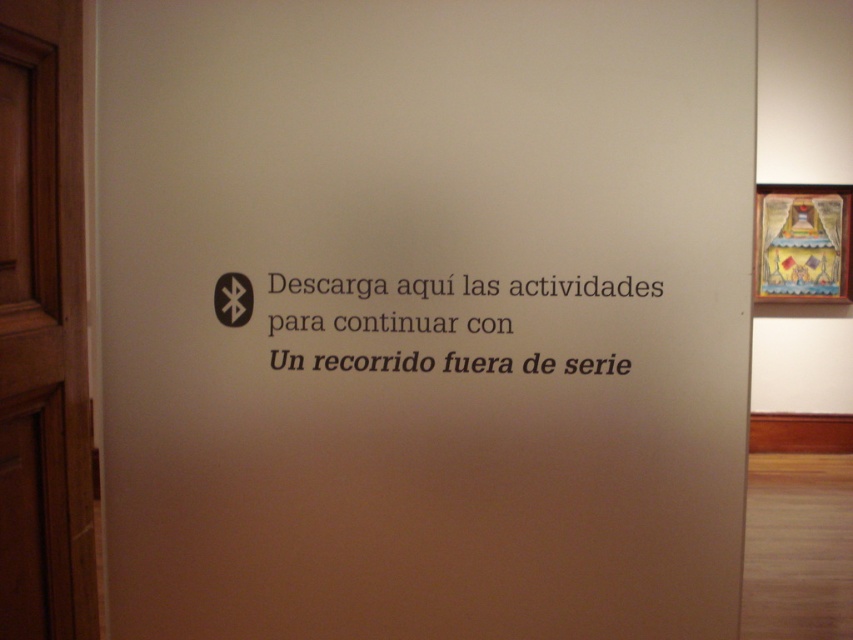
Is brown wooden door at left to the left of wooden painted artwork at upper right from the viewer's perspective?

Yes, brown wooden door at left is to the left of wooden painted artwork at upper right.

Is brown wooden door at left thinner than wooden painted artwork at upper right?

Yes.

Identify the location of brown wooden door at left. The width and height of the screenshot is (853, 640). point(44,330).

Looking at this image, is brown wooden door at left smaller than black paper text at center?

Actually, brown wooden door at left might be larger than black paper text at center.

The height and width of the screenshot is (640, 853). I want to click on brown wooden door at left, so tap(44, 330).

Is wooden painted artwork at upper right to the right of black paper text at center from the viewer's perspective?

Indeed, wooden painted artwork at upper right is positioned on the right side of black paper text at center.

Which is below, wooden painted artwork at upper right or black paper text at center?

black paper text at center

Which is behind, point (758, 273) or point (450, 276)?

The point (758, 273) is behind.

This screenshot has width=853, height=640. Identify the location of wooden painted artwork at upper right. (804, 243).